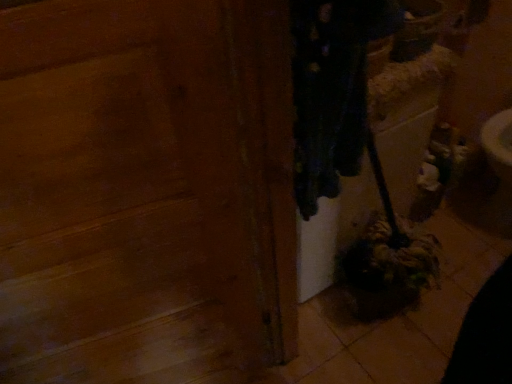
Image resolution: width=512 pixels, height=384 pixels. I want to click on wooden door at left, so click(x=145, y=192).

What do you see at coordinates (145, 192) in the screenshot?
I see `wooden door at left` at bounding box center [145, 192].

Find the location of a particular element. This screenshot has height=384, width=512. wooden door at left is located at coordinates tap(145, 192).